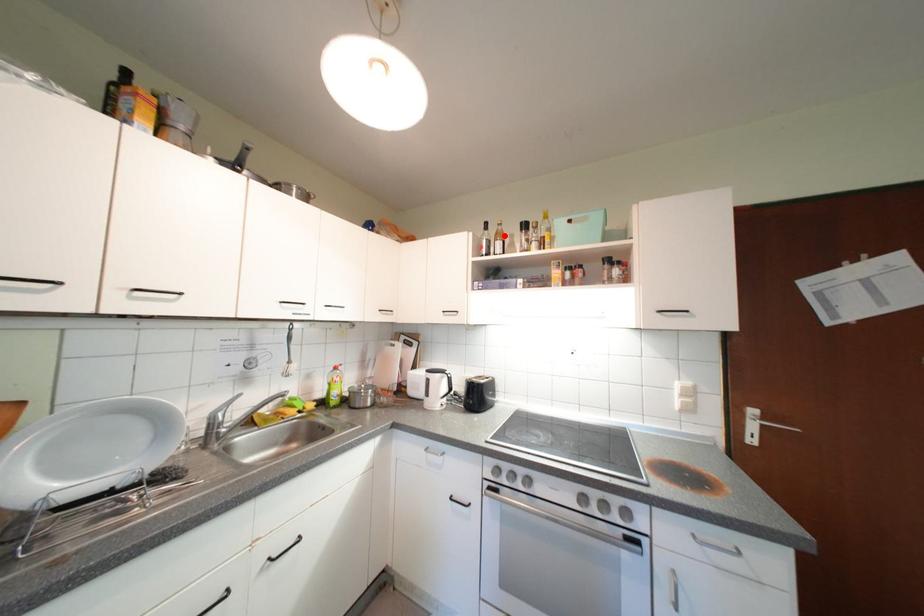
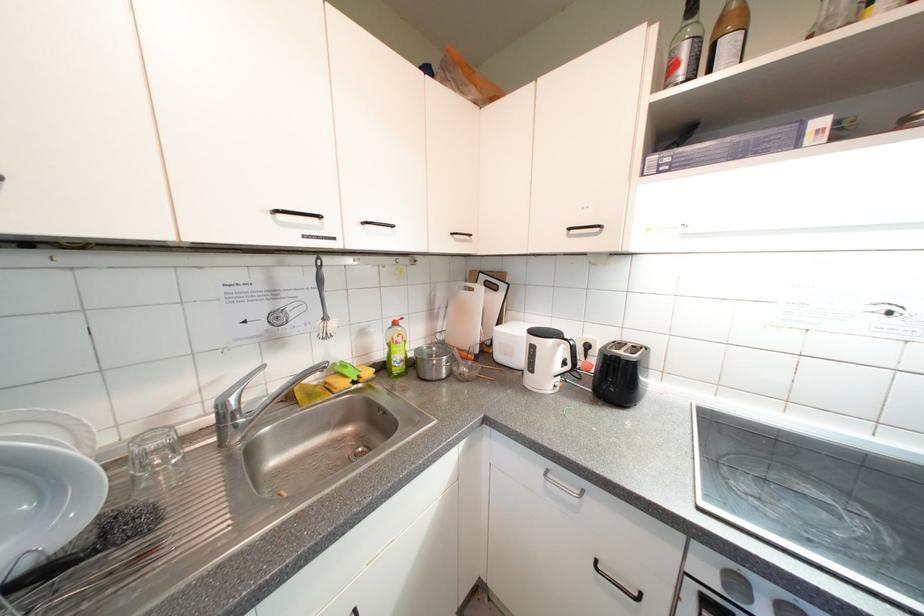
Find the pixel in the second image that matches the highlighted location in the first image.

(728, 23)